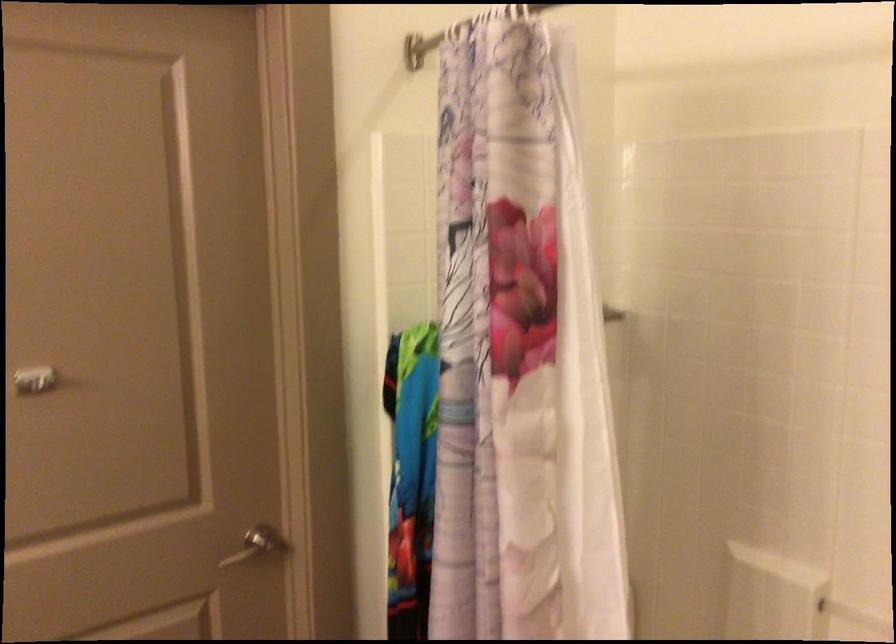
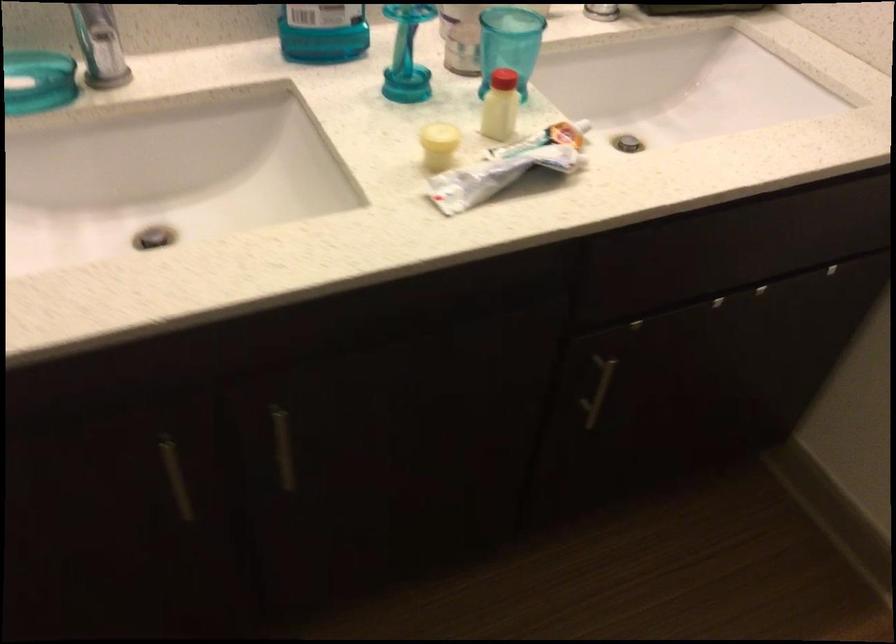
The images are taken continuously from a first-person perspective. In which direction is your viewpoint rotating?

The camera's rotation is toward left-down.